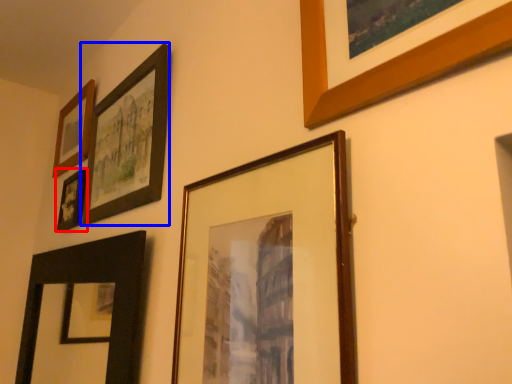
Question: Which object is closer to the camera taking this photo, picture frame (highlighted by a red box) or picture frame (highlighted by a blue box)?

Choices:
 (A) picture frame
 (B) picture frame

Answer: (B)